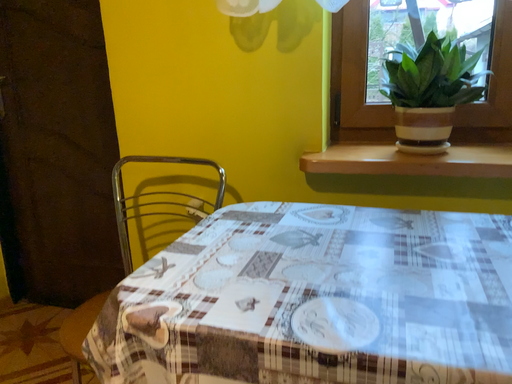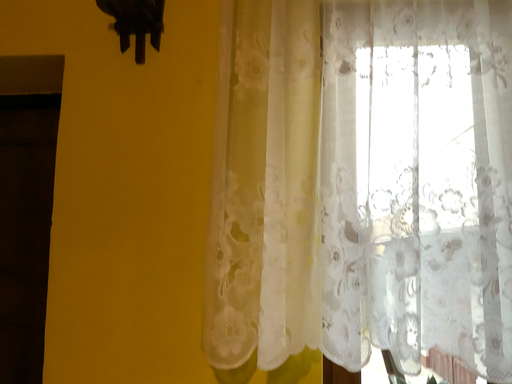
Question: How did the camera likely rotate when shooting the video?

Choices:
 (A) rotated left
 (B) rotated right

Answer: (B)